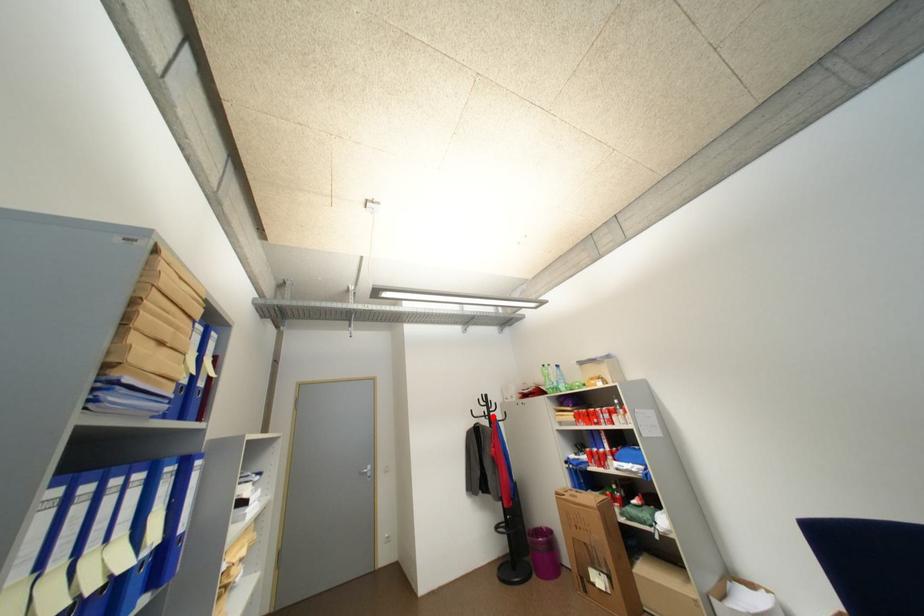
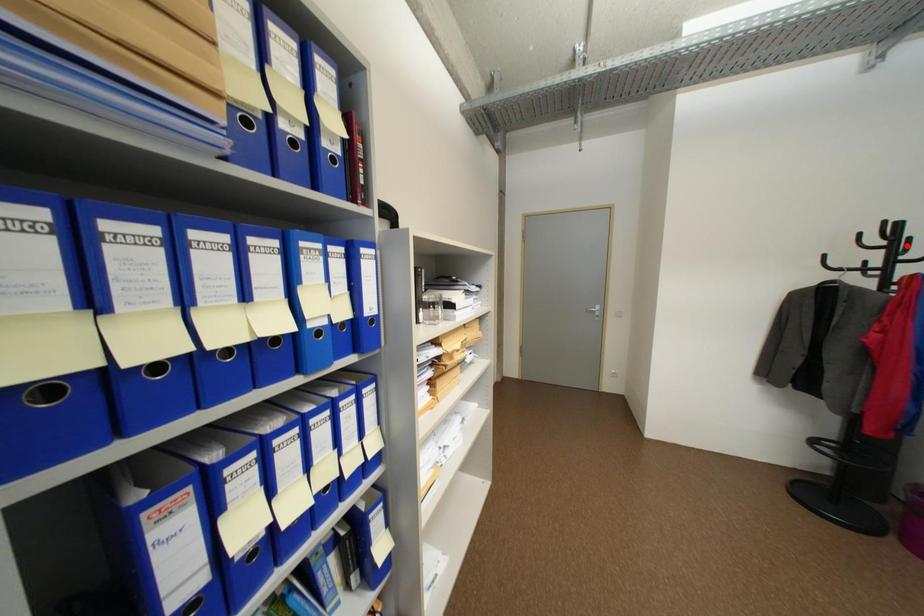
I am providing you with two images of the same scene from different viewpoints. A red point is marked on the first image and another point is marked on the second image. Is the marked point in image1 the same physical position as the marked point in image2?

No